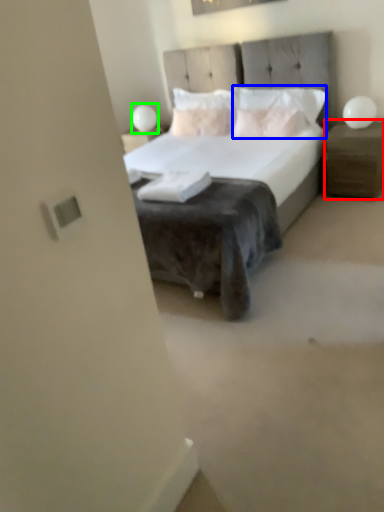
Question: Based on their relative distances, which object is nearer to nightstand (highlighted by a red box)? Choose from pillow (highlighted by a blue box) and table lamp (highlighted by a green box).

Choices:
 (A) pillow
 (B) table lamp

Answer: (A)